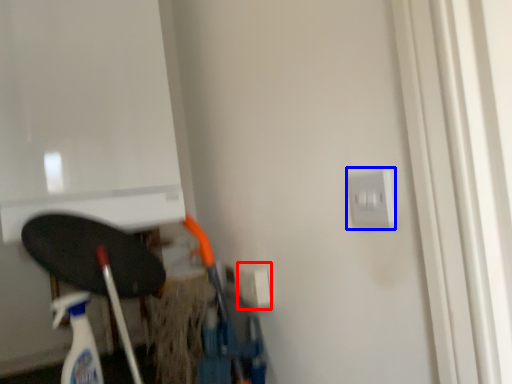
Question: Which object appears farthest to the camera in this image, electric outlet (highlighted by a red box) or electric outlet (highlighted by a blue box)?

Choices:
 (A) electric outlet
 (B) electric outlet

Answer: (A)